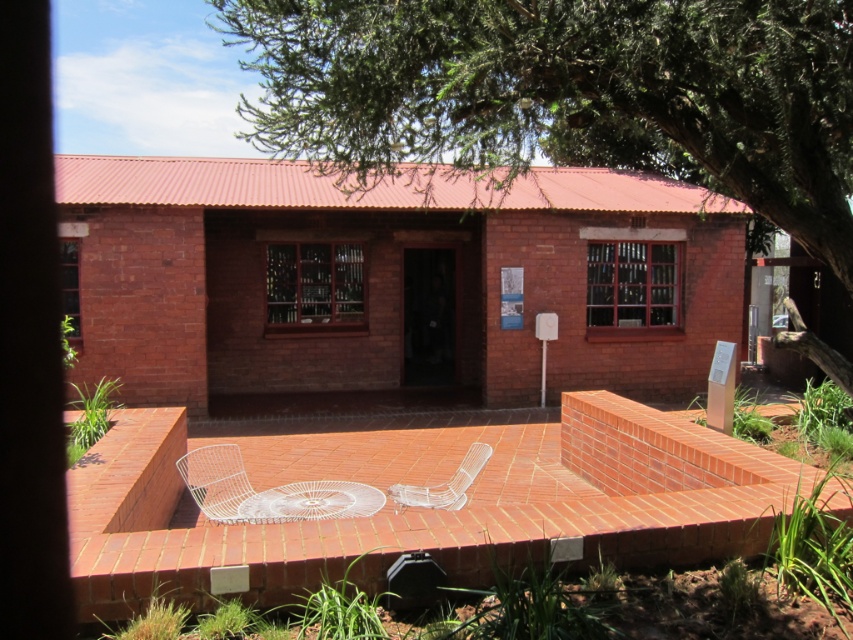
Question: Among these points, which one is farthest from the camera?

Choices:
 (A) (146, 372)
 (B) (811, 118)
 (C) (473, 468)
 (D) (229, 481)

Answer: (A)

Question: Which of the following is the closest to the observer?

Choices:
 (A) (299, 188)
 (B) (407, 502)

Answer: (B)

Question: From the image, what is the correct spatial relationship of green leafy tree at upper center in relation to white wire table at center?

Choices:
 (A) below
 (B) above

Answer: (B)

Question: Among these points, which one is farthest from the camera?

Choices:
 (A) (190, 461)
 (B) (447, 492)
 (C) (236, 508)

Answer: (A)

Question: Can you confirm if green leafy tree at upper center is thinner than white wire chair at center?

Choices:
 (A) yes
 (B) no

Answer: (B)

Question: Is terracotta brick terrace at center closer to the viewer compared to white wire chair at center?

Choices:
 (A) no
 (B) yes

Answer: (A)